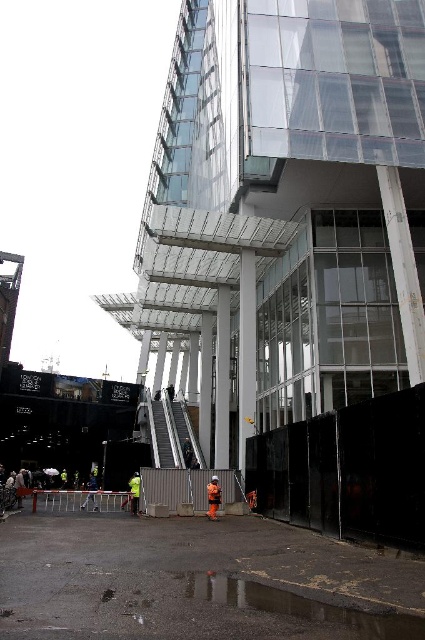
Question: In this image, where is concrete pavement at lower center located relative to metallic gray barricade at lower center?

Choices:
 (A) right
 (B) left

Answer: (A)

Question: Based on their relative distances, which object is nearer to the orange reflective vest at center?

Choices:
 (A) concrete pavement at lower center
 (B) metallic gray barricade at lower center
 (C) metal barricade at lower center
 (D) metallic silver escalator at center

Answer: (B)

Question: Which point appears closest to the camera in this image?

Choices:
 (A) (210, 516)
 (B) (85, 496)

Answer: (A)

Question: Is metallic gray barricade at lower center bigger than metallic silver escalator at center?

Choices:
 (A) no
 (B) yes

Answer: (A)

Question: Which object appears closest to the camera in this image?

Choices:
 (A) concrete pavement at lower center
 (B) metallic silver escalator at center

Answer: (A)

Question: Does metallic gray barricade at lower center have a smaller size compared to orange reflective vest at center?

Choices:
 (A) no
 (B) yes

Answer: (A)